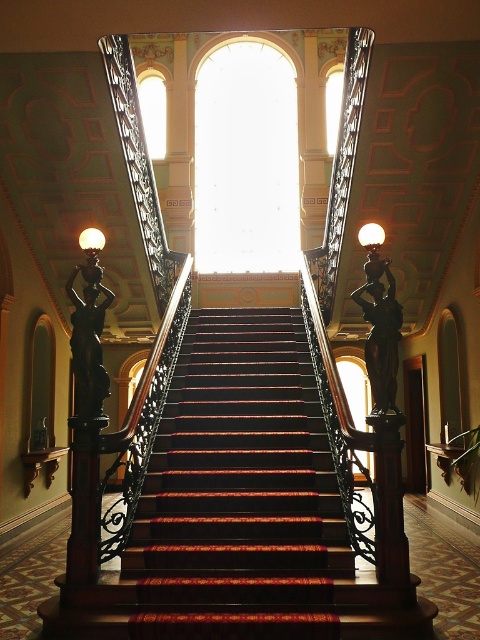
Question: Is wooden staircase at center wider than black polished statue at left?

Choices:
 (A) yes
 (B) no

Answer: (A)

Question: Among these points, which one is nearest to the camera?

Choices:
 (A) (301, 376)
 (B) (84, 275)

Answer: (B)

Question: Is wooden staircase at center wider than black polished statue at left?

Choices:
 (A) no
 (B) yes

Answer: (B)

Question: Can you confirm if wooden staircase at center is thinner than black polished statue at left?

Choices:
 (A) no
 (B) yes

Answer: (A)

Question: Which of the following is the closest to the observer?

Choices:
 (A) (255, 483)
 (B) (90, 376)

Answer: (B)